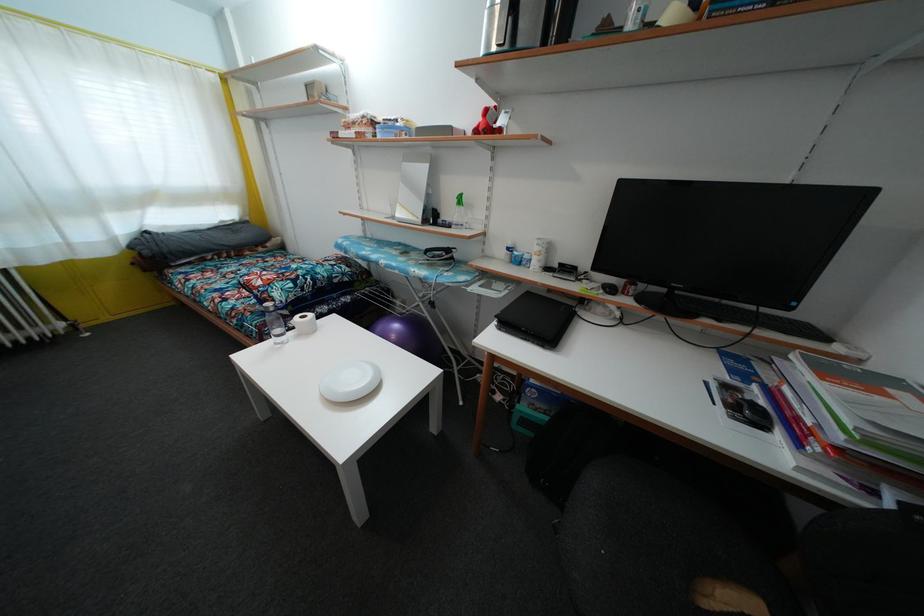
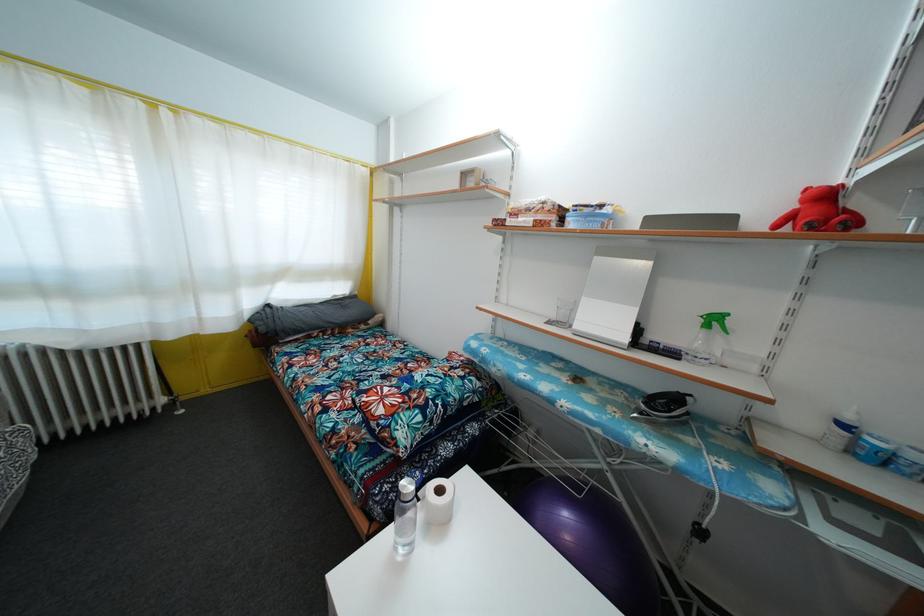
Locate, in the second image, the point that corresponds to point (512, 254) in the first image.

(848, 432)